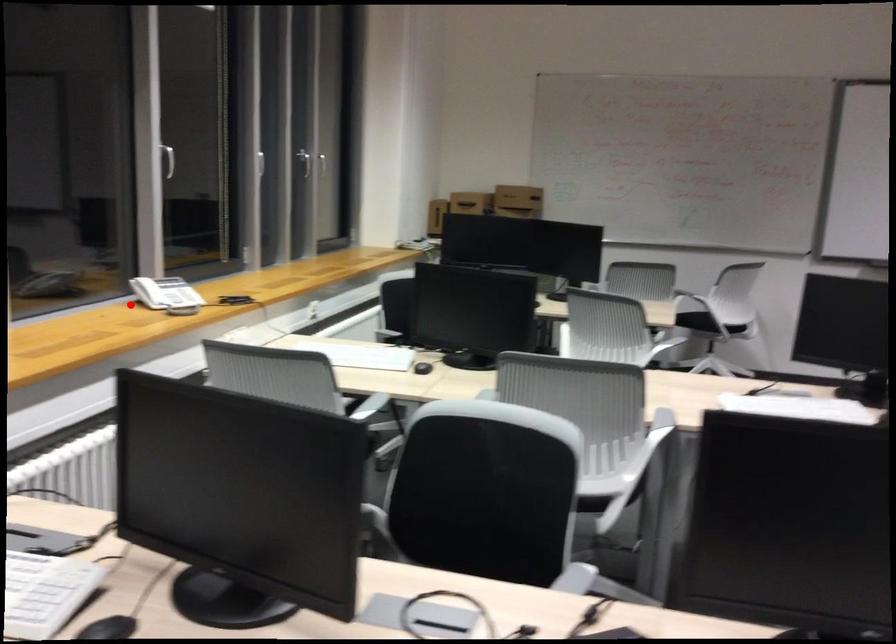
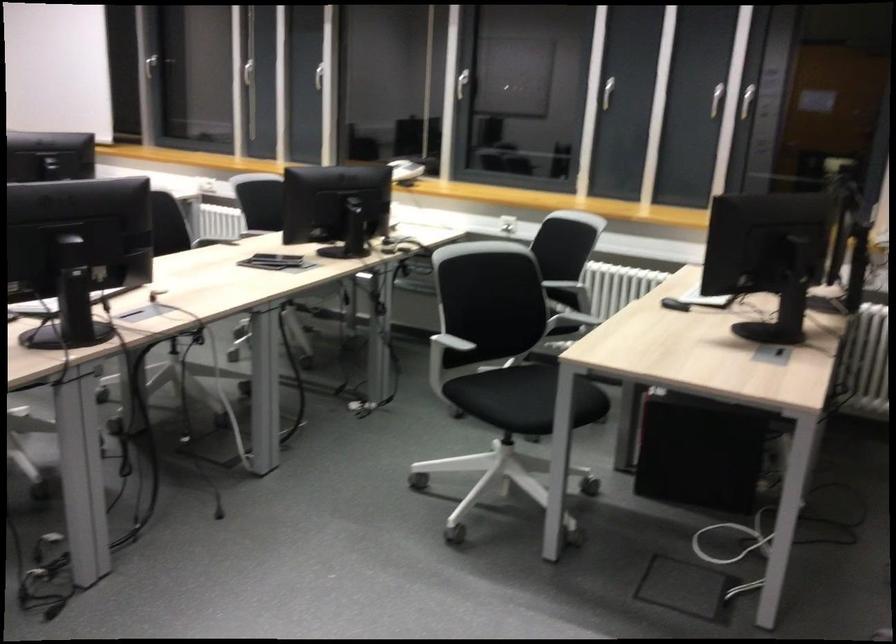
Find the pixel in the second image that matches the highlighted location in the first image.

(400, 163)